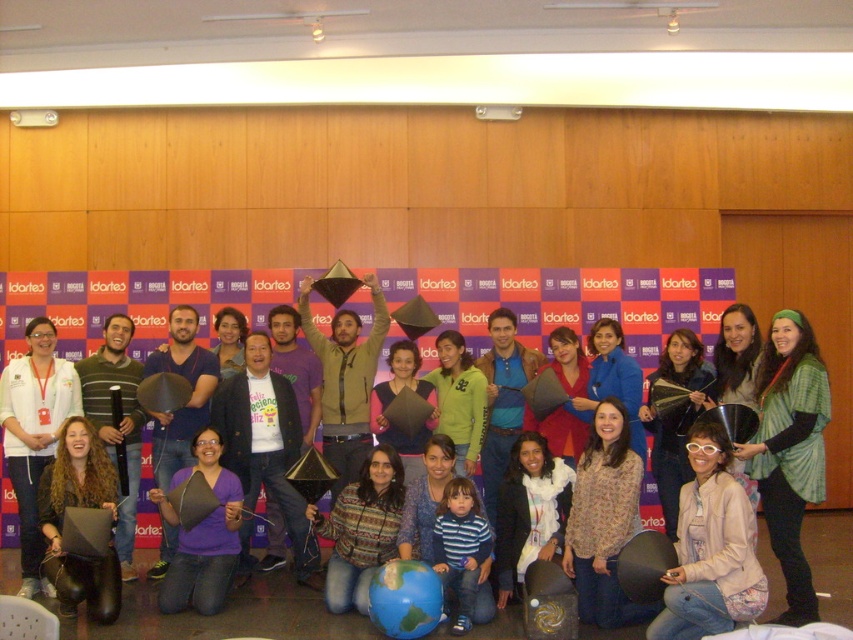
Question: Where is light beige jacket at lower right located in relation to floral print blouse at center in the image?

Choices:
 (A) right
 (B) left

Answer: (A)

Question: Among these points, which one is nearest to the camera?

Choices:
 (A) (717, 608)
 (B) (817, 452)
 (C) (62, 509)
 (D) (22, 396)

Answer: (A)

Question: Is matte black graduation cap at center in front of green knitted shawl at center?

Choices:
 (A) no
 (B) yes

Answer: (A)

Question: Which of the following is the farthest from the observer?

Choices:
 (A) (700, 465)
 (B) (4, 444)
 (C) (390, 480)

Answer: (B)

Question: Is matte black jacket at lower left below purple matte triangle at center?

Choices:
 (A) yes
 (B) no

Answer: (B)

Question: Which object appears farthest from the camera in this image?

Choices:
 (A) floral print blouse at center
 (B) knitted sweater at center

Answer: (B)